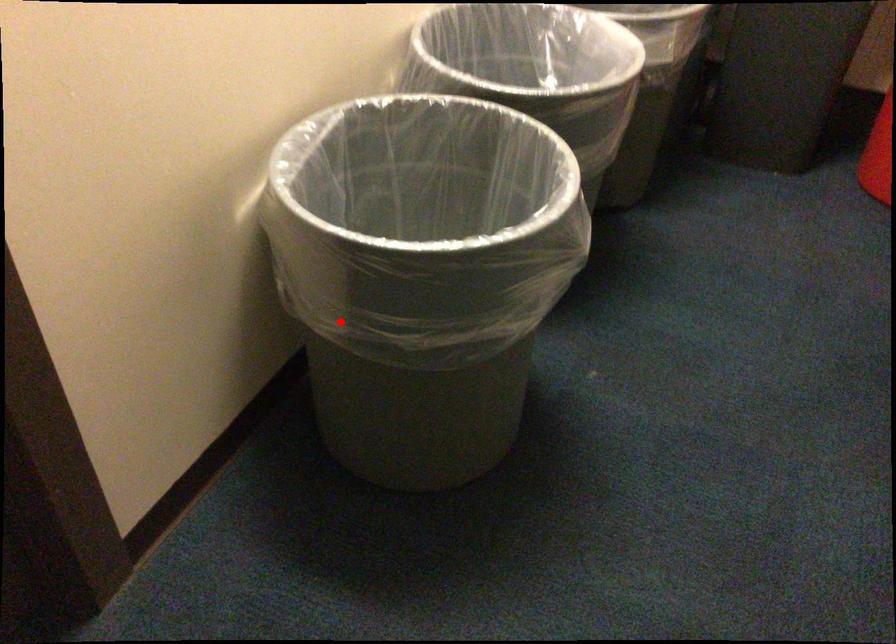
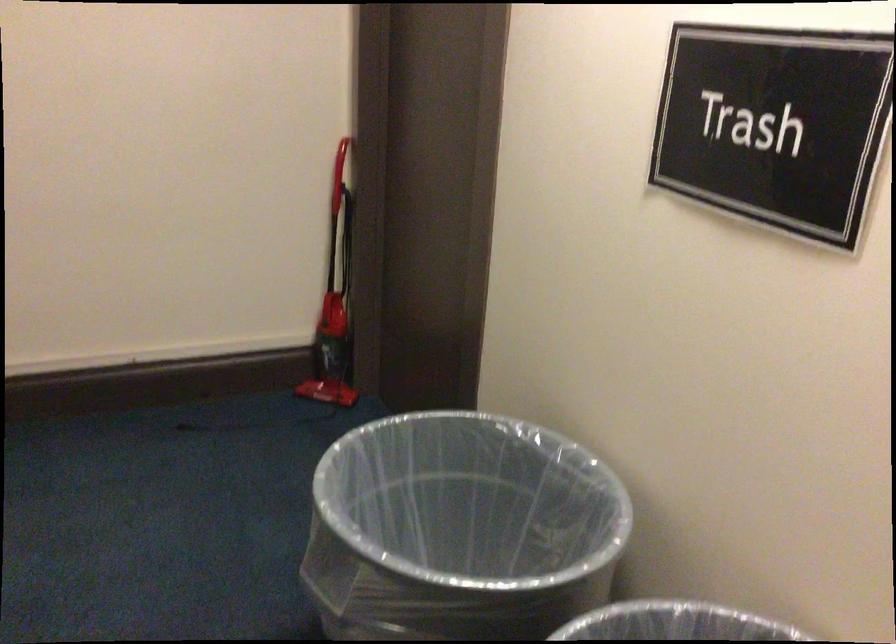
Question: A red point is marked in image1. In image2, is the corresponding 3D point closer to the camera or farther? Reply with the corresponding letter.

Choices:
 (A) The corresponding 3D point is closer.
 (B) The corresponding 3D point is farther.

Answer: (B)